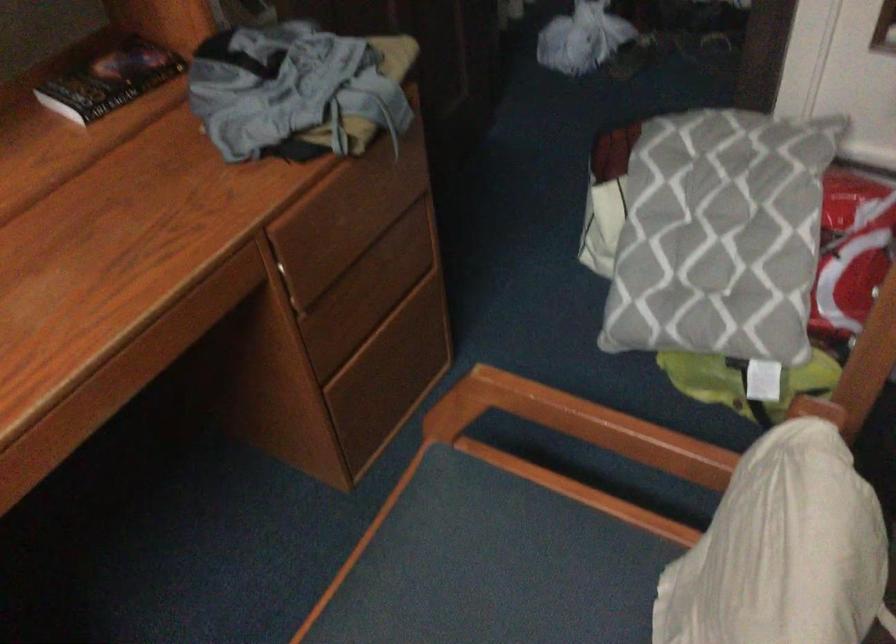
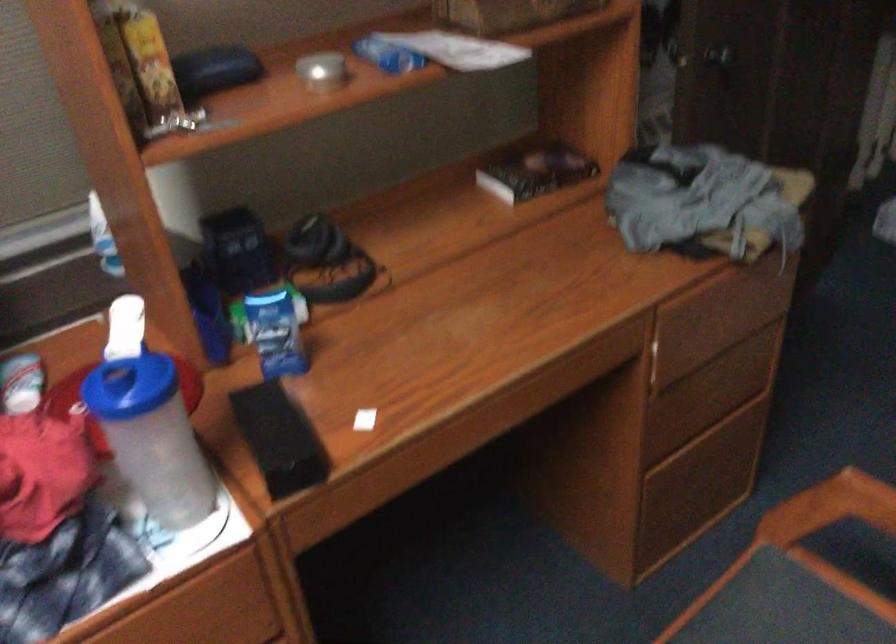
The point at (455,518) is marked in the first image. Where is the corresponding point in the second image?

(780, 614)